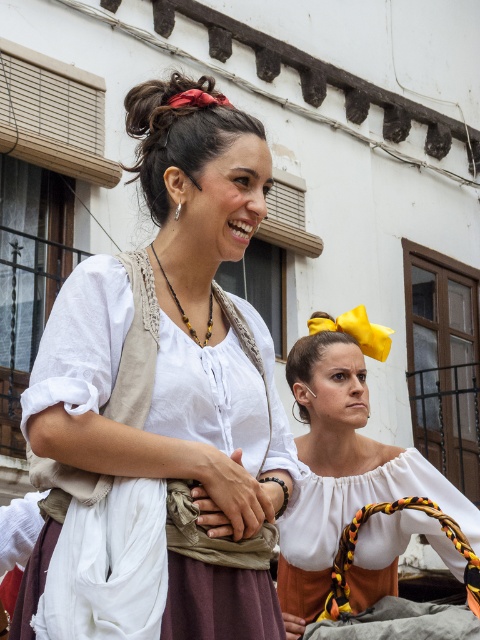
Who is lower down, white cotton blouse at center or matte white blouse at center?

matte white blouse at center is lower down.

Who is more distant from viewer, (124, 477) or (355, 410)?

The point (355, 410) is more distant.

At what (x,y) coordinates should I click in order to perform the action: click on white cotton blouse at center. Please return your answer as a coordinate pair (x, y). The image size is (480, 640). Looking at the image, I should click on (160, 401).